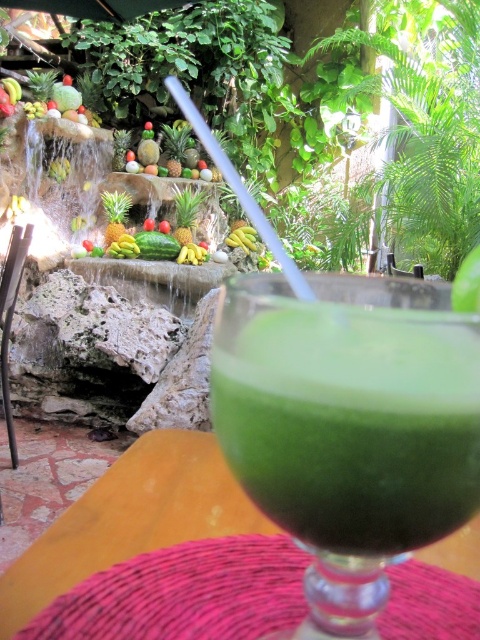
From the picture: You are at a tropical patio and see two groups of bananas on the waterfall rocks. The first group is labeled as yellow smooth banana at center, and the second group is yellow smooth bananas at center. Which group is positioned to the right?

The yellow smooth banana at center is positioned to the right of the yellow smooth bananas at center.

From the picture: You are holding a camera and want to take a photo of the tropical setting. The camera is currently positioned at a certain distance from the point marked as point (338, 483). If the recommended safe distance for capturing the entire scene without distortion is 7.45 inches, is your current position suitable?

The distance between the camera and point (338, 483) is exactly 7.45 inches, which matches the recommended safe distance. Therefore, your current position is suitable for capturing the entire scene without distortion.

You are a bartender preparing a fruit platter for a party. You have two options for bananas to use as garnish. The first is the yellow smooth banana at center, and the second is the yellow smooth bananas at center. Which banana option has a greater width for your garnish?

The yellow smooth banana at center has a greater width than the yellow smooth bananas at center.